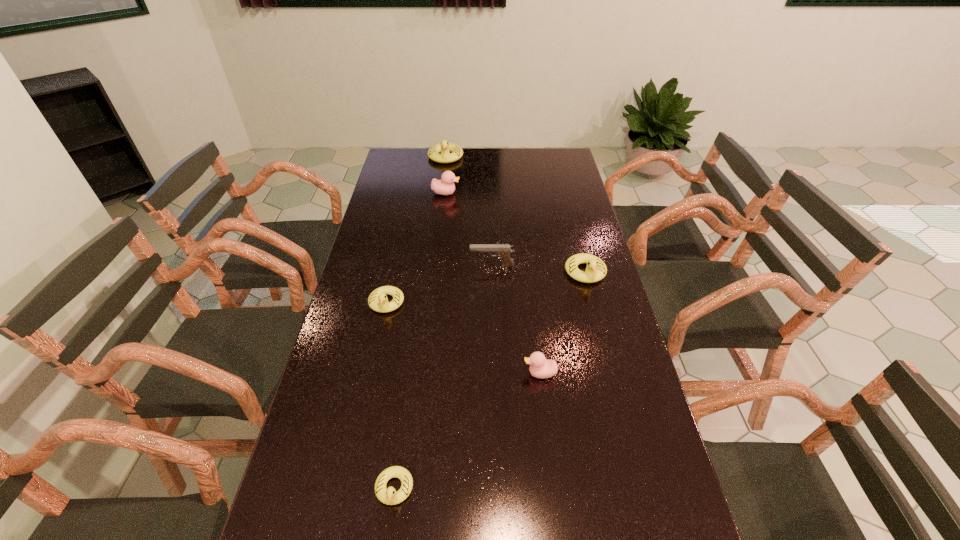
Locate an element on the screen. duckling identified as the third closest to the biggest yellow duckling is located at coordinates (378, 301).

Select which yellow duckling is the closest to the pistol. Please provide its 2D coordinates. Your answer should be formatted as a tuple, i.e. [(x, y)], where the tuple contains the x and y coordinates of a point satisfying the conditions above.

[(596, 269)]

Select which yellow duckling is the fourth closest to the fifth duckling from left to right. Please provide its 2D coordinates. Your answer should be formatted as a tuple, i.e. [(x, y)], where the tuple contains the x and y coordinates of a point satisfying the conditions above.

[(444, 147)]